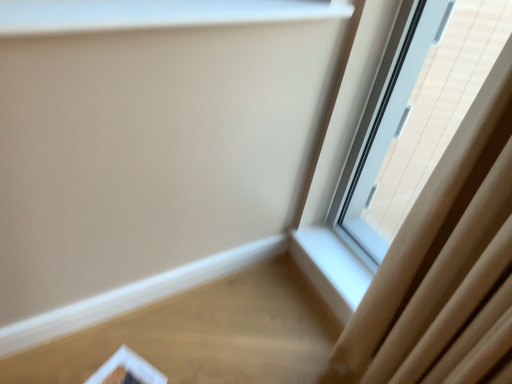
Describe the element at coordinates (418, 111) in the screenshot. I see `transparent glass window at upper right` at that location.

Where is `transparent glass window at upper right`? The image size is (512, 384). transparent glass window at upper right is located at coordinates (418, 111).

Find the location of a particular element. This screenshot has height=384, width=512. transparent glass window at upper right is located at coordinates point(418,111).